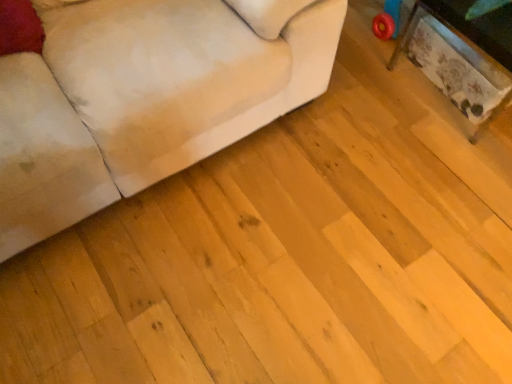
Question: Should I look upward or downward to see suede-like beige couch at lower left?

Choices:
 (A) down
 (B) up

Answer: (B)

Question: Would you say wooden textured table at right is outside suede-like beige couch at lower left?

Choices:
 (A) no
 (B) yes

Answer: (B)

Question: Is the depth of wooden textured table at right less than that of suede-like beige couch at lower left?

Choices:
 (A) no
 (B) yes

Answer: (A)

Question: Is wooden textured table at right thinner than suede-like beige couch at lower left?

Choices:
 (A) no
 (B) yes

Answer: (B)

Question: Does wooden textured table at right appear on the right side of suede-like beige couch at lower left?

Choices:
 (A) no
 (B) yes

Answer: (B)

Question: Are wooden textured table at right and suede-like beige couch at lower left making contact?

Choices:
 (A) no
 (B) yes

Answer: (A)

Question: From a real-world perspective, is wooden textured table at right under suede-like beige couch at lower left?

Choices:
 (A) no
 (B) yes

Answer: (B)

Question: Is suede-like beige couch at lower left turned away from wooden textured table at right?

Choices:
 (A) no
 (B) yes

Answer: (A)

Question: Does suede-like beige couch at lower left have a larger size compared to wooden textured table at right?

Choices:
 (A) yes
 (B) no

Answer: (A)

Question: Can you see suede-like beige couch at lower left touching wooden textured table at right?

Choices:
 (A) no
 (B) yes

Answer: (A)

Question: From a real-world perspective, is suede-like beige couch at lower left under wooden textured table at right?

Choices:
 (A) yes
 (B) no

Answer: (B)

Question: Would you consider suede-like beige couch at lower left to be distant from wooden textured table at right?

Choices:
 (A) yes
 (B) no

Answer: (B)

Question: Can you confirm if suede-like beige couch at lower left is taller than wooden textured table at right?

Choices:
 (A) yes
 (B) no

Answer: (A)

Question: Which is correct: suede-like beige couch at lower left is inside wooden textured table at right, or outside of it?

Choices:
 (A) inside
 (B) outside

Answer: (B)